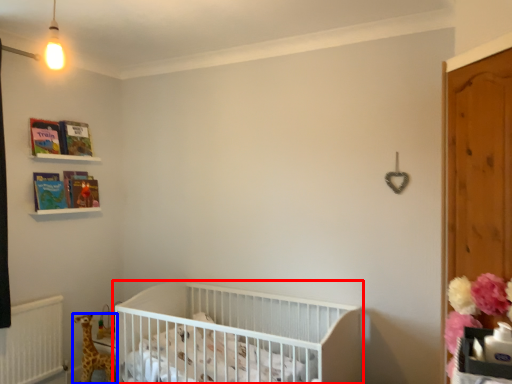
Question: Which point is closer to the camera, infant bed (highlighted by a red box) or giraffe (highlighted by a blue box)?

Choices:
 (A) infant bed
 (B) giraffe

Answer: (A)